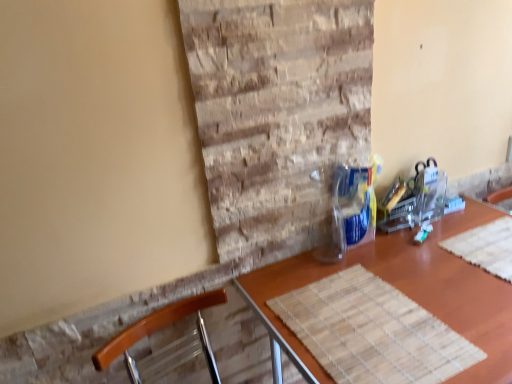
You are a GUI agent. You are given a task and a screenshot of the screen. Output one action in this format:
    pyautogui.click(x=<x>, y=<y>)
    Task: Click on the free spot above wooden placemat at center (from a real-world perspective)
    The width and height of the screenshot is (512, 384).
    Given the screenshot: What is the action you would take?
    pyautogui.click(x=413, y=287)